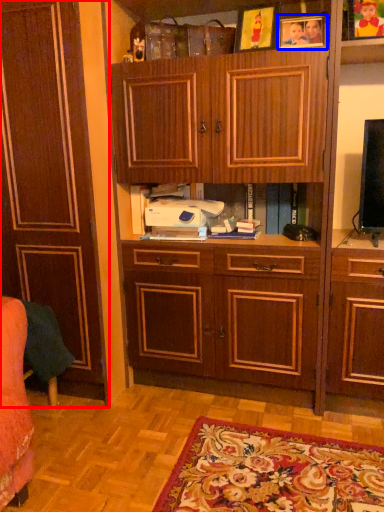
Question: Which of the following is the farthest to the observer, cabinetry (highlighted by a red box) or picture frame (highlighted by a blue box)?

Choices:
 (A) cabinetry
 (B) picture frame

Answer: (B)